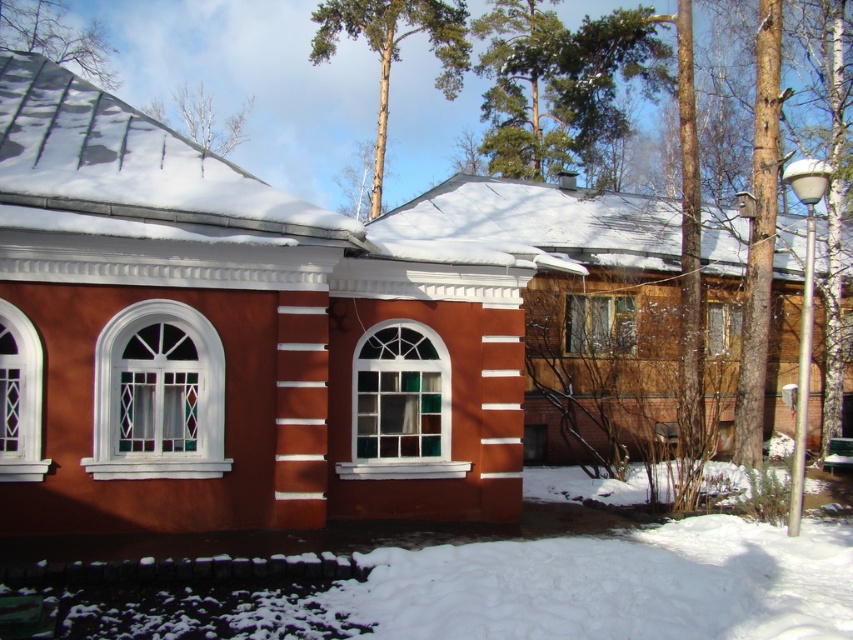
You are an architect designing a new winter house. You have two window options for the facade. The white glass window at left and the clear glass window at center. Which window is narrower in width?

The white glass window at left is thinner than the clear glass window at center, so the white glass window at left is narrower in width.

You are standing in front of the snow covered building and want to know if the green coniferous tree at upper center will block the view of the translucent glass window at center from your current position. Can you see the window through the tree?

The green coniferous tree at upper center is much taller than the translucent glass window at center, so the tree is likely blocking the view of the window from your current position.